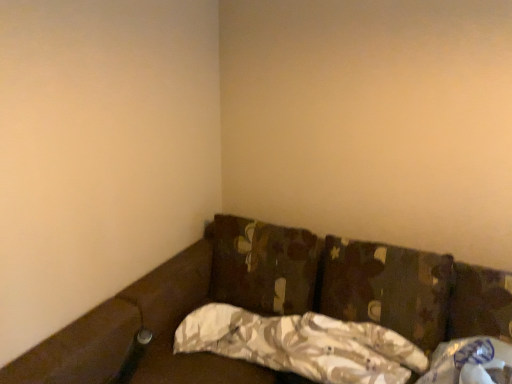
Describe the element at coordinates (263, 265) in the screenshot. I see `camouflage fabric pillow at center, acting as the third pillow starting from the right` at that location.

Find the location of a particular element. camo fabric pillow at center, the first pillow in the right-to-left sequence is located at coordinates (386, 288).

From the image's perspective, is white plastic bag at lower right above or below camouflage fabric pillow at center, which is the second pillow in right-to-left order?

white plastic bag at lower right is situated lower than camouflage fabric pillow at center, which is the second pillow in right-to-left order, in the image.

Where is `material that appears below the camouflage fabric pillow at center, which is the second pillow in right-to-left order (from a real-world perspective)`? The width and height of the screenshot is (512, 384). material that appears below the camouflage fabric pillow at center, which is the second pillow in right-to-left order (from a real-world perspective) is located at coordinates (470, 360).

Between white plastic bag at lower right and camouflage fabric pillow at center, which is the second pillow in right-to-left order, which one is positioned behind?

camouflage fabric pillow at center, which is the second pillow in right-to-left order, is further away from the camera.

Which is in front, camouflage fabric pillow at center, acting as the third pillow starting from the right, or camouflage fabric pillow at center, which is the second pillow in right-to-left order?

camouflage fabric pillow at center, which is the second pillow in right-to-left order, is in front.

In the image, is camouflage fabric pillow at center, acting as the third pillow starting from the right, on the left side or the right side of camouflage fabric pillow at center, acting as the second pillow starting from the left?

In the image, camouflage fabric pillow at center, acting as the third pillow starting from the right, appears on the left side of camouflage fabric pillow at center, acting as the second pillow starting from the left.

Who is bigger, camouflage fabric pillow at center, acting as the 1th pillow starting from the left, or camouflage fabric pillow at center, which is the second pillow in right-to-left order?

camouflage fabric pillow at center, acting as the 1th pillow starting from the left.

Which is in front, point (303, 281) or point (206, 320)?

The point (206, 320) is in front.

Is white plastic bag at lower right next to camo fabric pillow at center, the first pillow in the right-to-left sequence?

There is a gap between white plastic bag at lower right and camo fabric pillow at center, the first pillow in the right-to-left sequence.

Between point (463, 345) and point (378, 250), which one is positioned behind?

The point (378, 250) is more distant.

Is white plastic bag at lower right in front of or behind camo fabric pillow at center, the 3th pillow positioned from the left, in the image?

white plastic bag at lower right is in front of camo fabric pillow at center, the 3th pillow positioned from the left.

Considering the positions of point (319, 333) and point (426, 303), is point (319, 333) closer or farther from the camera than point (426, 303)?

Point (319, 333) appears to be closer to the viewer than point (426, 303).

Who is more distant, camouflage fabric pillow at center, which is the second pillow in right-to-left order, or camo fabric pillow at center, the 3th pillow positioned from the left?

camo fabric pillow at center, the 3th pillow positioned from the left, is behind.

Which object is wider, camouflage fabric pillow at center, acting as the second pillow starting from the left, or camo fabric pillow at center, the 3th pillow positioned from the left?

camouflage fabric pillow at center, acting as the second pillow starting from the left.

From the image's perspective, which is below, camo fabric pillow at center, the 3th pillow positioned from the left, or camouflage fabric pillow at center, acting as the second pillow starting from the left?

camouflage fabric pillow at center, acting as the second pillow starting from the left.

Between point (444, 284) and point (376, 382), which one is positioned behind?

The point (444, 284) is farther from the camera.

In order to click on the 1st pillow to the left when counting from the camo fabric pillow at center, the first pillow in the right-to-left sequence in this screenshot , I will do `click(302, 345)`.

Visually, is camo fabric pillow at center, the 3th pillow positioned from the left, positioned to the left or to the right of camouflage fabric pillow at center, acting as the second pillow starting from the left?

In the image, camo fabric pillow at center, the 3th pillow positioned from the left, appears on the right side of camouflage fabric pillow at center, acting as the second pillow starting from the left.

Between camouflage fabric pillow at center, acting as the second pillow starting from the left, and camouflage fabric pillow at center, acting as the 1th pillow starting from the left, which one has more height?

Standing taller between the two is camouflage fabric pillow at center, acting as the 1th pillow starting from the left.

Which of these two, camouflage fabric pillow at center, which is the second pillow in right-to-left order, or camouflage fabric pillow at center, acting as the 1th pillow starting from the left, is wider?

Wider between the two is camouflage fabric pillow at center, which is the second pillow in right-to-left order.

What's the angular difference between camouflage fabric pillow at center, acting as the second pillow starting from the left, and camouflage fabric pillow at center, acting as the 1th pillow starting from the left,'s facing directions?

camouflage fabric pillow at center, acting as the second pillow starting from the left, and camouflage fabric pillow at center, acting as the 1th pillow starting from the left, are facing 8.61 degrees away from each other.

How distant is camouflage fabric pillow at center, acting as the second pillow starting from the left, from camouflage fabric pillow at center, acting as the 1th pillow starting from the left?

They are 28.84 centimeters apart.

Is camouflage fabric pillow at center, acting as the 1th pillow starting from the left, facing towards camo fabric pillow at center, the 3th pillow positioned from the left?

No, camouflage fabric pillow at center, acting as the 1th pillow starting from the left, is not oriented towards camo fabric pillow at center, the 3th pillow positioned from the left.

Is camouflage fabric pillow at center, acting as the 1th pillow starting from the left, to the right of camo fabric pillow at center, the first pillow in the right-to-left sequence, from the viewer's perspective?

In fact, camouflage fabric pillow at center, acting as the 1th pillow starting from the left, is to the left of camo fabric pillow at center, the first pillow in the right-to-left sequence.

Which object is further away from the camera, camouflage fabric pillow at center, acting as the 1th pillow starting from the left, or camo fabric pillow at center, the 3th pillow positioned from the left?

camouflage fabric pillow at center, acting as the 1th pillow starting from the left, is further from the camera.

How many degrees apart are the facing directions of camouflage fabric pillow at center, acting as the third pillow starting from the right, and camo fabric pillow at center, the first pillow in the right-to-left sequence?

camouflage fabric pillow at center, acting as the third pillow starting from the right, and camo fabric pillow at center, the first pillow in the right-to-left sequence, are facing 9.85 degrees away from each other.

You are a GUI agent. You are given a task and a screenshot of the screen. Output one action in this format:
    pyautogui.click(x=<x>, y=<y>)
    Task: Click on the 1st pillow directly above the white plastic bag at lower right (from a real-world perspective)
    This screenshot has height=384, width=512.
    Given the screenshot: What is the action you would take?
    pyautogui.click(x=302, y=345)

This screenshot has width=512, height=384. Identify the location of the 2nd pillow positioned above the camouflage fabric pillow at center, acting as the second pillow starting from the left (from the image's perspective). (263, 265).

Based on their spatial positions, is camo fabric pillow at center, the 3th pillow positioned from the left, or camouflage fabric pillow at center, acting as the third pillow starting from the right, closer to white plastic bag at lower right?

camo fabric pillow at center, the 3th pillow positioned from the left, is positioned closer to the anchor white plastic bag at lower right.

From the image, which object appears to be farther from camouflage fabric pillow at center, which is the second pillow in right-to-left order, camouflage fabric pillow at center, acting as the 1th pillow starting from the left, or camo fabric pillow at center, the first pillow in the right-to-left sequence?

The object further to camouflage fabric pillow at center, which is the second pillow in right-to-left order, is camouflage fabric pillow at center, acting as the 1th pillow starting from the left.

Which object lies further to the anchor point camo fabric pillow at center, the 3th pillow positioned from the left, camouflage fabric pillow at center, acting as the second pillow starting from the left, or white plastic bag at lower right?

white plastic bag at lower right lies further to camo fabric pillow at center, the 3th pillow positioned from the left, than the other object.

Considering their positions, is camouflage fabric pillow at center, acting as the third pillow starting from the right, positioned closer to camo fabric pillow at center, the 3th pillow positioned from the left, than camouflage fabric pillow at center, which is the second pillow in right-to-left order?

camouflage fabric pillow at center, which is the second pillow in right-to-left order.

Based on their spatial positions, is camo fabric pillow at center, the 3th pillow positioned from the left, or camouflage fabric pillow at center, acting as the 1th pillow starting from the left, further from camouflage fabric pillow at center, which is the second pillow in right-to-left order?

Based on the image, camouflage fabric pillow at center, acting as the 1th pillow starting from the left, appears to be further to camouflage fabric pillow at center, which is the second pillow in right-to-left order.

Looking at the image, which one is located further to camo fabric pillow at center, the first pillow in the right-to-left sequence, camouflage fabric pillow at center, acting as the 1th pillow starting from the left, or white plastic bag at lower right?

camouflage fabric pillow at center, acting as the 1th pillow starting from the left, is positioned further to the anchor camo fabric pillow at center, the first pillow in the right-to-left sequence.

Which object lies further to the anchor point white plastic bag at lower right, camouflage fabric pillow at center, which is the second pillow in right-to-left order, or camouflage fabric pillow at center, acting as the third pillow starting from the right?

camouflage fabric pillow at center, acting as the third pillow starting from the right.

When comparing their distances from white plastic bag at lower right, does camouflage fabric pillow at center, acting as the 1th pillow starting from the left, or camo fabric pillow at center, the first pillow in the right-to-left sequence, seem closer?

camo fabric pillow at center, the first pillow in the right-to-left sequence, is positioned closer to the anchor white plastic bag at lower right.

Where is `pillow located between camouflage fabric pillow at center, acting as the 1th pillow starting from the left, and camo fabric pillow at center, the first pillow in the right-to-left sequence, in the left-right direction`? This screenshot has height=384, width=512. pillow located between camouflage fabric pillow at center, acting as the 1th pillow starting from the left, and camo fabric pillow at center, the first pillow in the right-to-left sequence, in the left-right direction is located at coordinates (302, 345).

Locate an element on the screen. pillow situated between camouflage fabric pillow at center, which is the second pillow in right-to-left order, and white plastic bag at lower right from left to right is located at coordinates (386, 288).